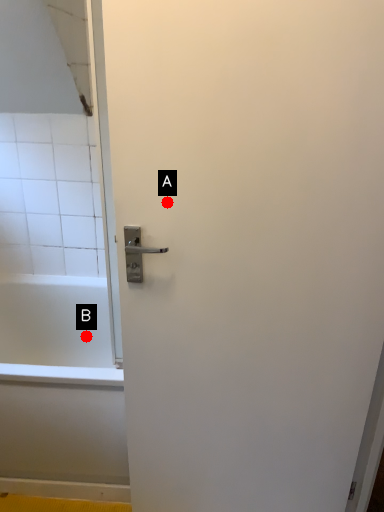
Question: Two points are circled on the image, labeled by A and B beside each circle. Which point is farther from the camera taking this photo?

Choices:
 (A) A is further
 (B) B is further

Answer: (B)